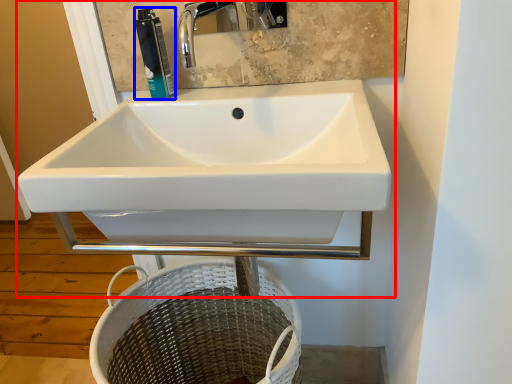
Question: Which point is further to the camera, sink (highlighted by a red box) or toiletry (highlighted by a blue box)?

Choices:
 (A) sink
 (B) toiletry

Answer: (B)